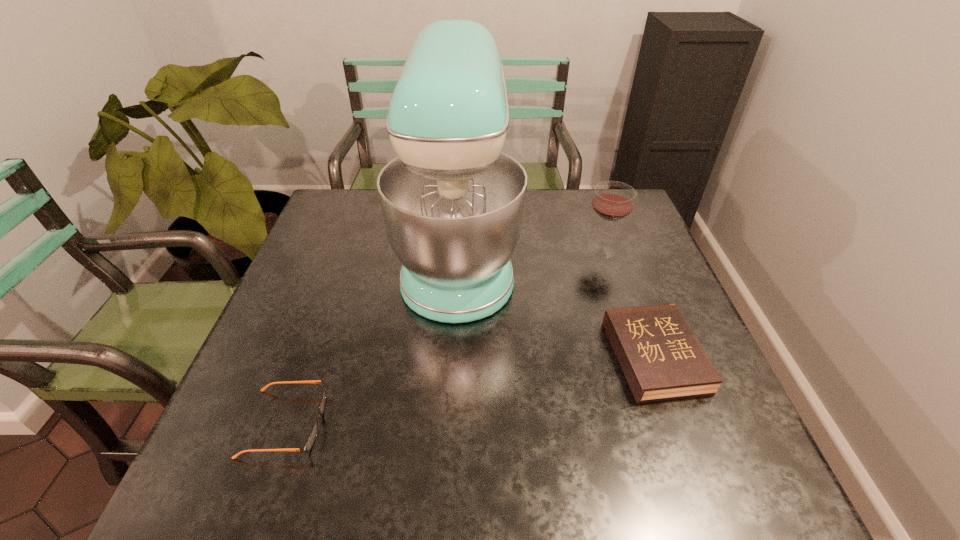
Where is `free spot between the wineglass and the mixer`? free spot between the wineglass and the mixer is located at coordinates (530, 253).

You are a GUI agent. You are given a task and a screenshot of the screen. Output one action in this format:
    pyautogui.click(x=<x>, y=<y>)
    Task: Click on the vacant space that is in between the third object from right to left and the hardback book
    This screenshot has height=540, width=960.
    Given the screenshot: What is the action you would take?
    pyautogui.click(x=557, y=306)

The width and height of the screenshot is (960, 540). In order to click on free area in between the hardback book and the leftmost object in this screenshot , I will do `click(470, 390)`.

This screenshot has width=960, height=540. I want to click on object that ranks as the closest to the shortest object, so click(453, 205).

Locate an element on the screen. the third closest object to the hardback book is located at coordinates (311, 438).

This screenshot has width=960, height=540. Identify the location of vacant position in the image that satisfies the following two spatial constraints: 1. on the front side of the wineglass; 2. on the left side of the hardback book. tap(637, 356).

Image resolution: width=960 pixels, height=540 pixels. I want to click on free region that satisfies the following two spatial constraints: 1. at the base of the hardback book; 2. on the left side of the third object from right to left, so click(453, 356).

Locate an element on the screen. This screenshot has width=960, height=540. vacant position in the image that satisfies the following two spatial constraints: 1. at the base of the hardback book; 2. on the left side of the tallest object is located at coordinates (453, 356).

At what (x,y) coordinates should I click in order to perform the action: click on vacant point that satisfies the following two spatial constraints: 1. at the base of the mixer; 2. on the left side of the hardback book. Please return your answer as a coordinate pair (x, y). This screenshot has width=960, height=540. Looking at the image, I should click on (453, 356).